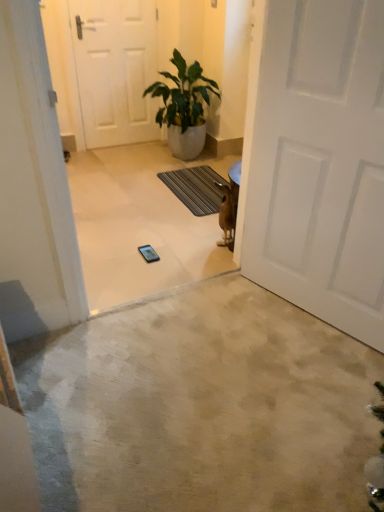
Where is `free spot to the left of white matte door at center, marked as the first door in a right-to-left arrangement`? The width and height of the screenshot is (384, 512). free spot to the left of white matte door at center, marked as the first door in a right-to-left arrangement is located at coordinates pyautogui.click(x=235, y=341).